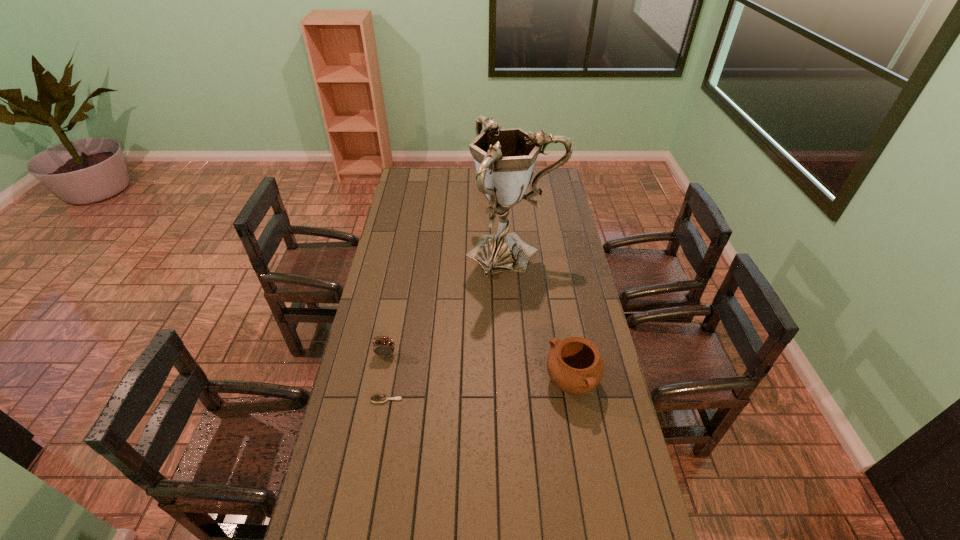
The height and width of the screenshot is (540, 960). Find the location of `object identified as the fourth closest to the shortest object`. object identified as the fourth closest to the shortest object is located at coordinates pos(500,127).

Image resolution: width=960 pixels, height=540 pixels. Find the location of `free location that satisfies the following two spatial constraints: 1. on the face of the alarm clock; 2. on the right side of the scrubbing brush`. free location that satisfies the following two spatial constraints: 1. on the face of the alarm clock; 2. on the right side of the scrubbing brush is located at coordinates (377, 400).

Where is `blank space that satisfies the following two spatial constraints: 1. on the back side of the tallest object; 2. on the right side of the scrubbing brush`? This screenshot has height=540, width=960. blank space that satisfies the following two spatial constraints: 1. on the back side of the tallest object; 2. on the right side of the scrubbing brush is located at coordinates (412, 253).

Where is `vacant region that satisfies the following two spatial constraints: 1. on the back side of the scrubbing brush; 2. on the right side of the second tallest object`? Image resolution: width=960 pixels, height=540 pixels. vacant region that satisfies the following two spatial constraints: 1. on the back side of the scrubbing brush; 2. on the right side of the second tallest object is located at coordinates (425, 179).

Image resolution: width=960 pixels, height=540 pixels. Identify the location of free space that satisfies the following two spatial constraints: 1. on the back side of the shortest object; 2. on the right side of the pottery. (390, 383).

The image size is (960, 540). I want to click on vacant space that satisfies the following two spatial constraints: 1. on the face of the third tallest object; 2. on the right side of the second shortest object, so click(380, 383).